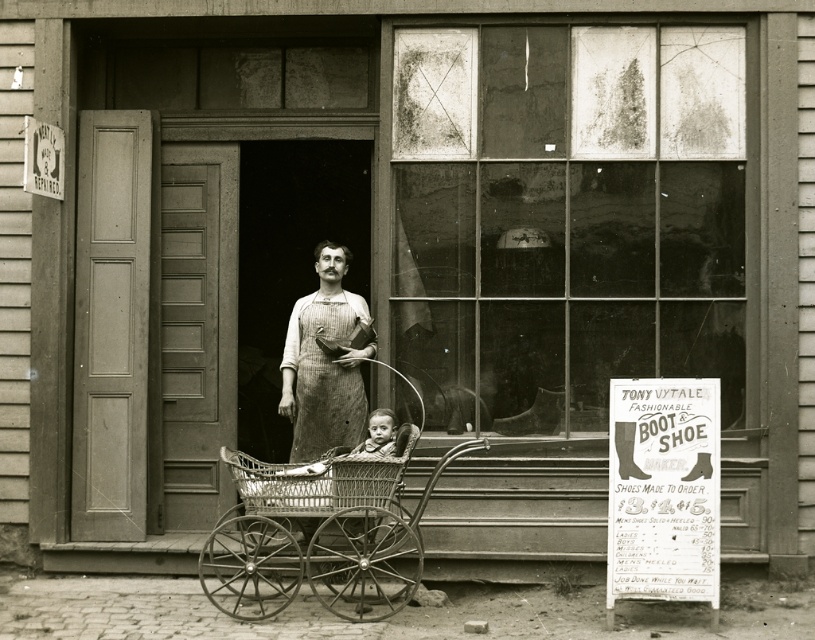
Measure the distance from wicker baby carriage at center to rustic linen apron at center.

wicker baby carriage at center is 71.83 centimeters away from rustic linen apron at center.

Does point (228, 589) come farther from viewer compared to point (313, 365)?

That is False.

Which is behind, point (261, 524) or point (360, 433)?

Point (360, 433)

Where is `wicker baby carriage at center`? The image size is (815, 640). wicker baby carriage at center is located at coordinates (320, 532).